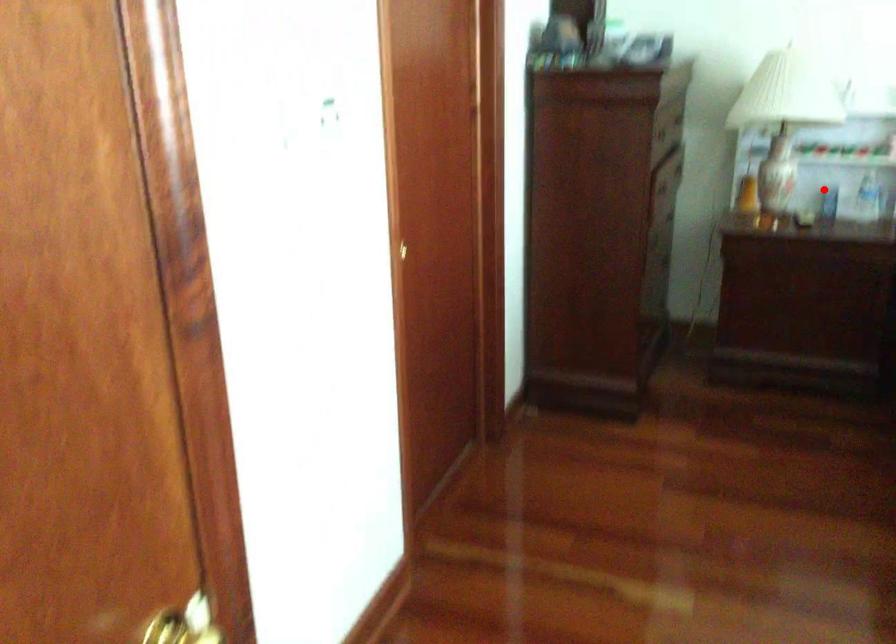
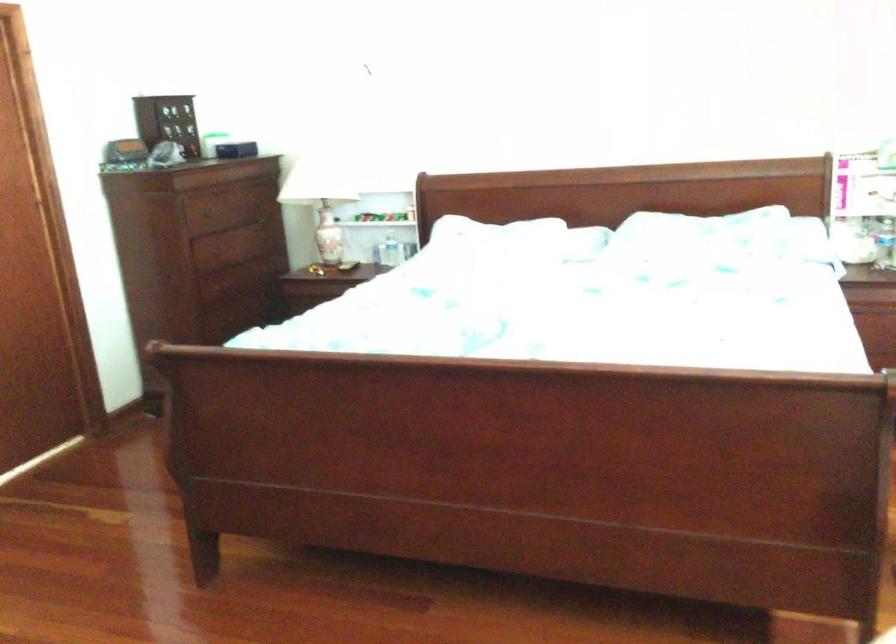
Question: I am providing you with two images of the same scene from different viewpoints. Image1 has a red point marked. In image2, the corresponding 3D location appears at what relative position? Reply with the corresponding letter.

Choices:
 (A) Closer
 (B) Farther

Answer: (B)